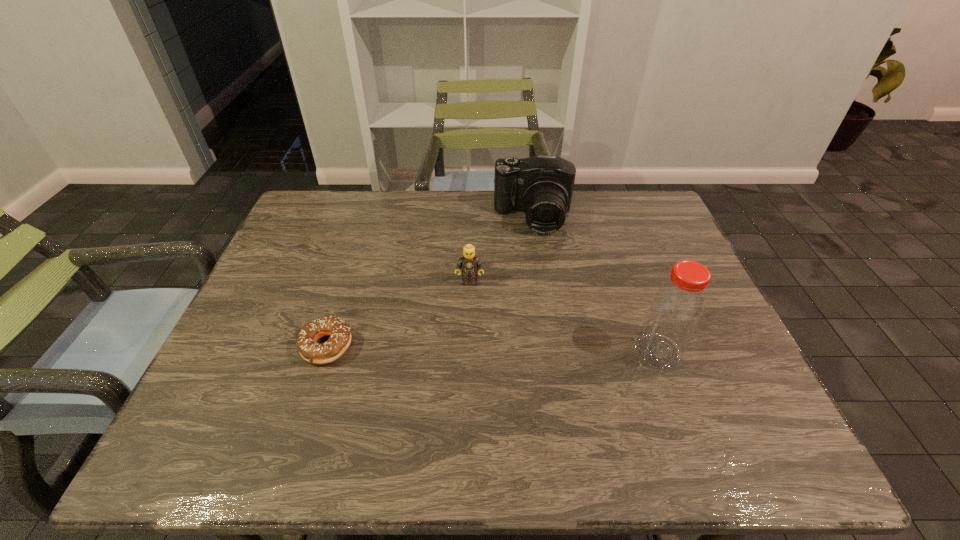
Image resolution: width=960 pixels, height=540 pixels. In the image, there is a desktop. Find the location of `blank space at the left edge`. blank space at the left edge is located at coordinates (285, 286).

Where is `free space at the right edge of the desktop`? The height and width of the screenshot is (540, 960). free space at the right edge of the desktop is located at coordinates (660, 281).

The width and height of the screenshot is (960, 540). I want to click on vacant space at the far left corner of the desktop, so click(338, 227).

Where is `blank area at the far right corner`? Image resolution: width=960 pixels, height=540 pixels. blank area at the far right corner is located at coordinates (619, 201).

Locate an element on the screen. Image resolution: width=960 pixels, height=540 pixels. vacant region between the Lego and the third object from left to right is located at coordinates (501, 250).

In order to click on free space between the second tallest object and the third tallest object in this screenshot , I will do point(501,250).

This screenshot has width=960, height=540. Identify the location of vacant space that is in between the farthest object and the leftmost object. (430, 282).

You are a GUI agent. You are given a task and a screenshot of the screen. Output one action in this format:
    pyautogui.click(x=<x>, y=<y>)
    Task: Click on the unoccupied position between the tallest object and the second object from right to left
    
    Given the screenshot: What is the action you would take?
    pyautogui.click(x=595, y=285)

At what (x,y) coordinates should I click in order to perform the action: click on empty space between the doughnut and the bottle. Please return your answer as a coordinate pair (x, y). Image resolution: width=960 pixels, height=540 pixels. Looking at the image, I should click on (492, 349).

You are a GUI agent. You are given a task and a screenshot of the screen. Output one action in this format:
    pyautogui.click(x=<x>, y=<y>)
    Task: Click on the vacant area between the farthest object and the tallest object
    This screenshot has width=960, height=540.
    Given the screenshot: What is the action you would take?
    pyautogui.click(x=595, y=285)